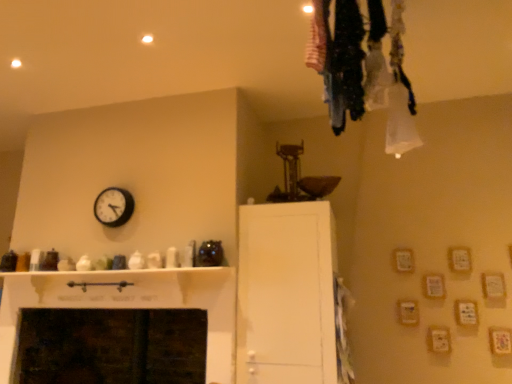
Question: Does white plastic clock at upper left have a larger size compared to white matte cabinet at center?

Choices:
 (A) no
 (B) yes

Answer: (A)

Question: Does white plastic clock at upper left appear on the right side of white matte cabinet at center?

Choices:
 (A) yes
 (B) no

Answer: (B)

Question: From a real-world perspective, does white plastic clock at upper left sit lower than white matte cabinet at center?

Choices:
 (A) yes
 (B) no

Answer: (B)

Question: Can you confirm if white plastic clock at upper left is positioned to the left of white matte cabinet at center?

Choices:
 (A) no
 (B) yes

Answer: (B)

Question: From a real-world perspective, is white plastic clock at upper left positioned over white matte cabinet at center based on gravity?

Choices:
 (A) yes
 (B) no

Answer: (A)

Question: Does white plastic clock at upper left contain white matte cabinet at center?

Choices:
 (A) yes
 (B) no

Answer: (B)

Question: Is white matte cabinet at center bigger than white plastic clock at upper left?

Choices:
 (A) yes
 (B) no

Answer: (A)

Question: Is white plastic clock at upper left at the back of white matte cabinet at center?

Choices:
 (A) no
 (B) yes

Answer: (A)

Question: Is white matte cabinet at center thinner than white plastic clock at upper left?

Choices:
 (A) yes
 (B) no

Answer: (B)

Question: From the image's perspective, is white matte cabinet at center over white plastic clock at upper left?

Choices:
 (A) no
 (B) yes

Answer: (A)

Question: Can you confirm if white matte cabinet at center is positioned to the left of white plastic clock at upper left?

Choices:
 (A) no
 (B) yes

Answer: (A)

Question: Considering the relative sizes of white matte cabinet at center and white plastic clock at upper left in the image provided, is white matte cabinet at center shorter than white plastic clock at upper left?

Choices:
 (A) no
 (B) yes

Answer: (A)

Question: Is white plastic clock at upper left inside the boundaries of white matte cabinet at center, or outside?

Choices:
 (A) inside
 (B) outside

Answer: (B)